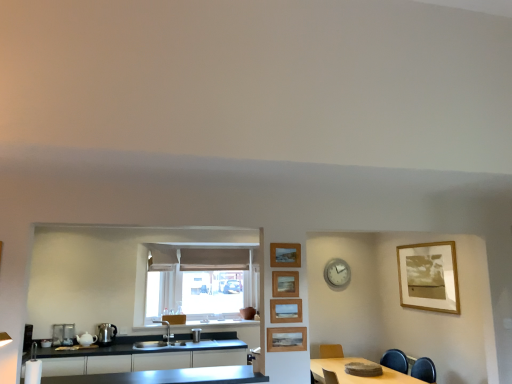
Question: In the image, is satin silver faucet at center, the 3th appliance from the left, on the left side or the right side of stainless steel countertop at lower center?

Choices:
 (A) right
 (B) left

Answer: (A)

Question: From a real-world perspective, is satin silver faucet at center, the 1th appliance in the right-to-left sequence, physically located above or below stainless steel countertop at lower center?

Choices:
 (A) below
 (B) above

Answer: (B)

Question: Which is nearer to the shiny metallic kettle at lower left, the second appliance from the left?

Choices:
 (A) matte black cabinets at lower left
 (B) metallic silver toaster at lower left, the first appliance positioned from the left
 (C) stainless steel countertop at lower center
 (D) wooden picture frame at upper center, the first picture frame positioned from the left
 (E) satin silver faucet at center, the 1th appliance in the right-to-left sequence

Answer: (B)

Question: Which object is positioned farthest from the metallic silver toaster at lower left, the 3th appliance from the right?

Choices:
 (A) wooden picture frame at upper center, positioned as the third picture frame in left-to-right order
 (B) wooden picture frame at center, which is the 1th picture frame from front to back
 (C) shiny metallic kettle at lower left, positioned as the 2th appliance in right-to-left order
 (D) wooden table at lower right
 (E) matte black cabinets at lower left

Answer: (D)